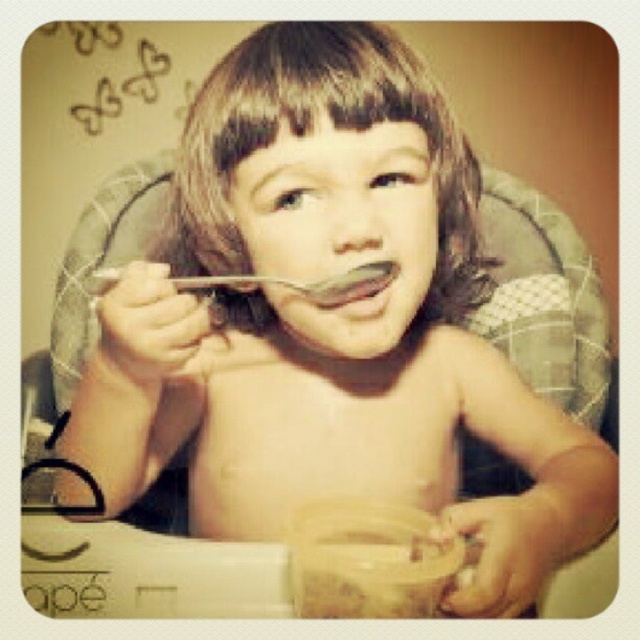
Is translucent plastic jar at lower center further to the viewer compared to matte silver spoon at mouth?

No.

Find the location of a particular element. translucent plastic jar at lower center is located at coordinates (369, 561).

Which of these two, translucent plastic jar at lower center or metallic silver spoon at mouth, stands taller?

translucent plastic jar at lower center is taller.

Does translucent plastic jar at lower center appear over metallic silver spoon at mouth?

Actually, translucent plastic jar at lower center is below metallic silver spoon at mouth.

What are the coordinates of `translucent plastic jar at lower center` in the screenshot? It's located at (369, 561).

Does metallic silver spoon at mouth have a larger size compared to matte silver spoon at mouth?

Indeed, metallic silver spoon at mouth has a larger size compared to matte silver spoon at mouth.

Identify the location of metallic silver spoon at mouth. (304, 284).